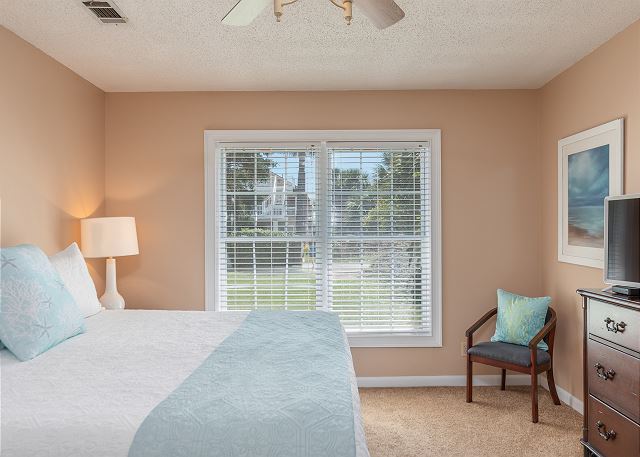
This screenshot has width=640, height=457. Identify the location of 3 drawer dresser. (607, 304), (604, 372), (618, 433), (614, 326).